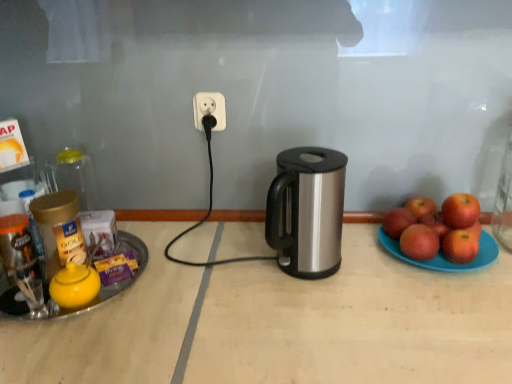
Question: Is white plastic power outlet at center positioned in front of red matte apple at right, which is counted as the 2th apple, starting from the front?

Choices:
 (A) no
 (B) yes

Answer: (A)

Question: Would you say white plastic power outlet at center is outside red matte apple at right, the 5th apple in the back-to-front sequence?

Choices:
 (A) yes
 (B) no

Answer: (A)

Question: Is white plastic power outlet at center aimed at red matte apple at right, the 5th apple in the back-to-front sequence?

Choices:
 (A) yes
 (B) no

Answer: (B)

Question: Does white plastic power outlet at center touch red matte apple at right, which is counted as the 2th apple, starting from the front?

Choices:
 (A) no
 (B) yes

Answer: (A)

Question: Is white plastic power outlet at center wider than red matte apple at right, the 5th apple in the back-to-front sequence?

Choices:
 (A) yes
 (B) no

Answer: (B)

Question: From a real-world perspective, does white plastic power outlet at center sit lower than red matte apple at right, the 5th apple in the back-to-front sequence?

Choices:
 (A) yes
 (B) no

Answer: (B)

Question: Are blue plastic plate at right and red matte apple at right, positioned as the 5th apple in front-to-back order, beside each other?

Choices:
 (A) yes
 (B) no

Answer: (A)

Question: Is blue plastic plate at right positioned beyond the bounds of red matte apple at right, positioned as the 5th apple in front-to-back order?

Choices:
 (A) yes
 (B) no

Answer: (A)

Question: From the image's perspective, is blue plastic plate at right located above red matte apple at right, positioned as the 5th apple in front-to-back order?

Choices:
 (A) yes
 (B) no

Answer: (B)

Question: Is blue plastic plate at right oriented away from red matte apple at right, positioned as the 5th apple in front-to-back order?

Choices:
 (A) no
 (B) yes

Answer: (A)

Question: Is the position of blue plastic plate at right less distant than that of red matte apple at right, positioned as the 5th apple in front-to-back order?

Choices:
 (A) no
 (B) yes

Answer: (B)

Question: Is blue plastic plate at right thinner than red matte apple at right, positioned as the 5th apple in front-to-back order?

Choices:
 (A) no
 (B) yes

Answer: (A)

Question: From the image's perspective, does red matte apple at right, positioned as the 5th apple in front-to-back order, appear lower than silver metallic kettle at center?

Choices:
 (A) no
 (B) yes

Answer: (B)